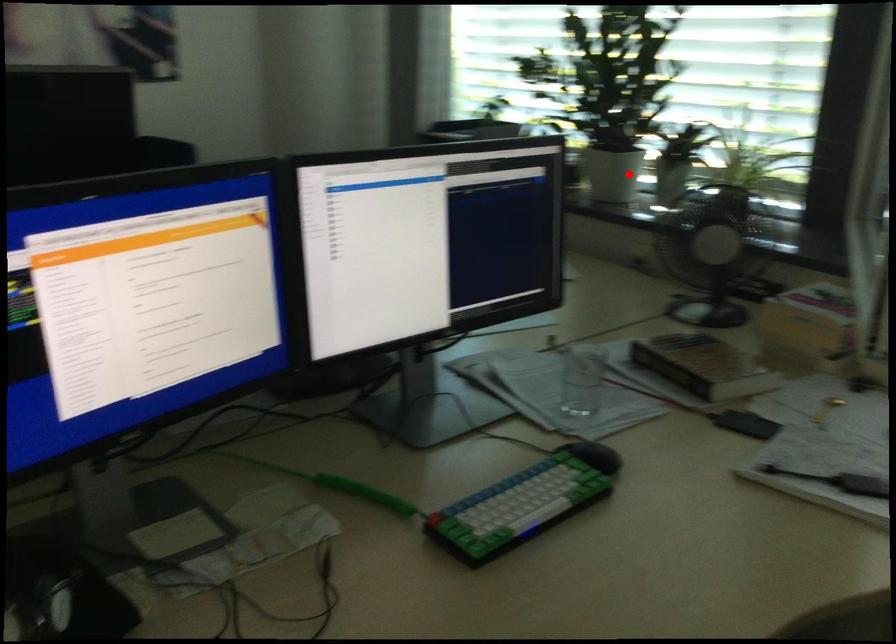
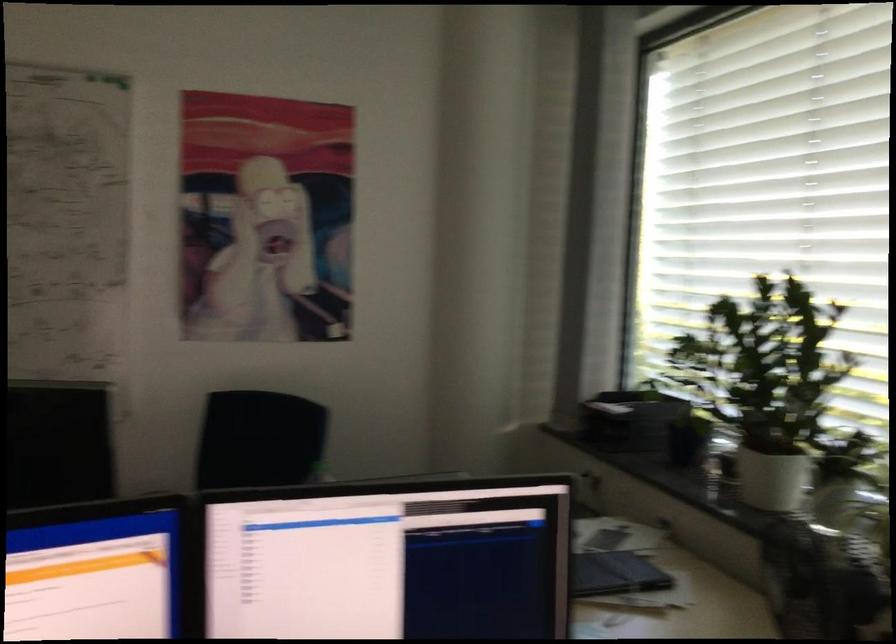
Question: I am providing you with two images of the same scene from different viewpoints. In image1, a red point is highlighted. Considering the same 3D point in image2, which of the following is correct?

Choices:
 (A) It is closer
 (B) It is farther

Answer: (A)